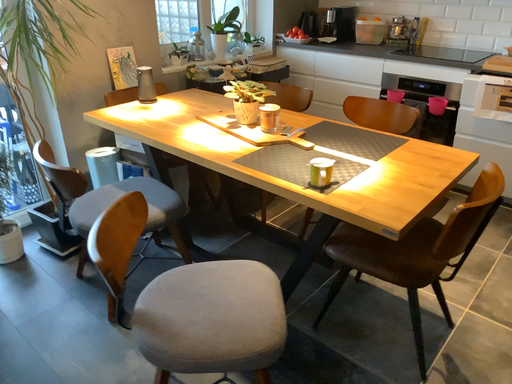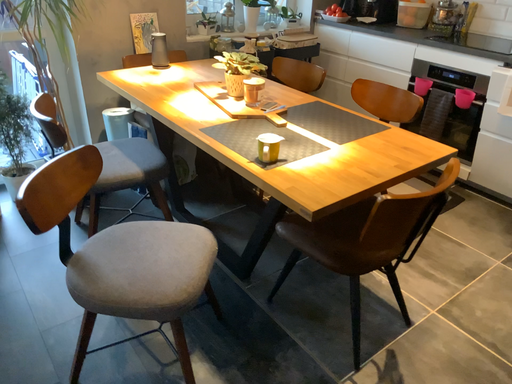
Question: How did the camera likely rotate when shooting the video?

Choices:
 (A) rotated right
 (B) rotated left

Answer: (B)